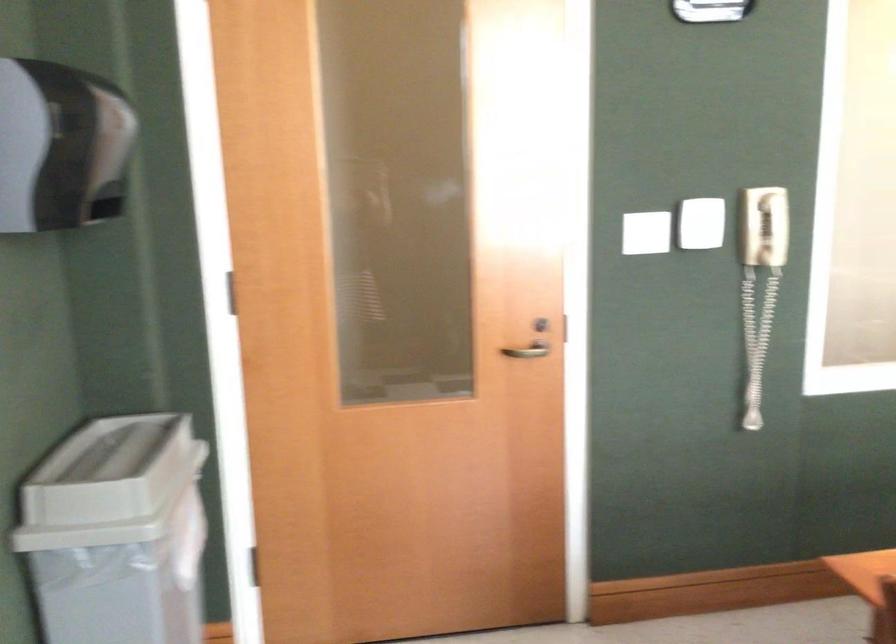
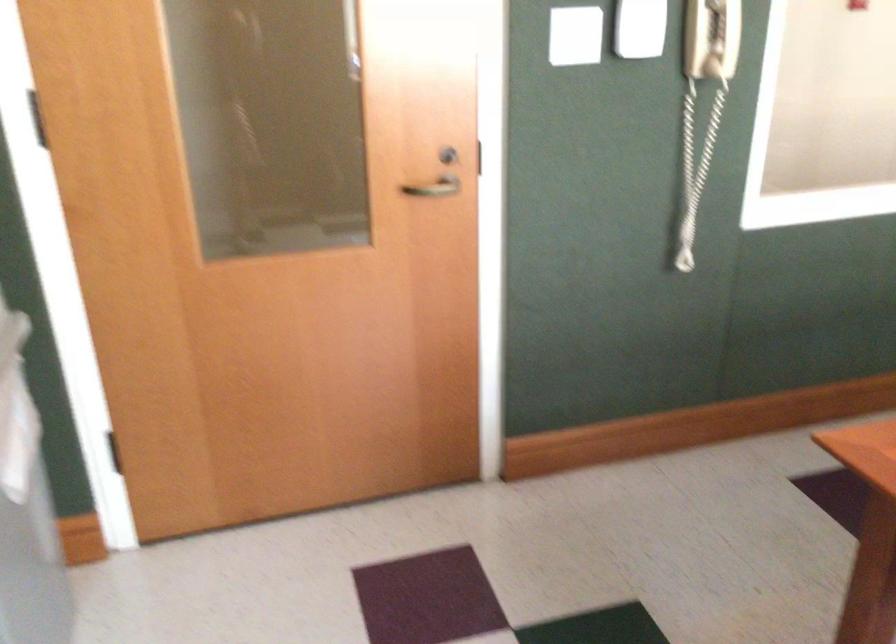
Question: What movement of the cameraman would produce the second image?

Choices:
 (A) Left
 (B) Right
 (C) Forward
 (D) Backward

Answer: (C)